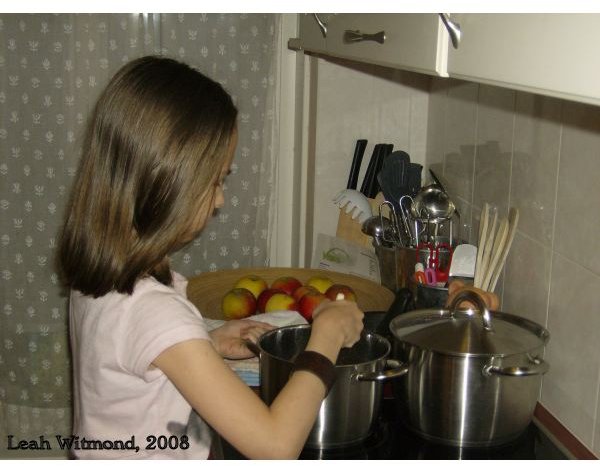
I want to click on bowl, so click(369, 286).